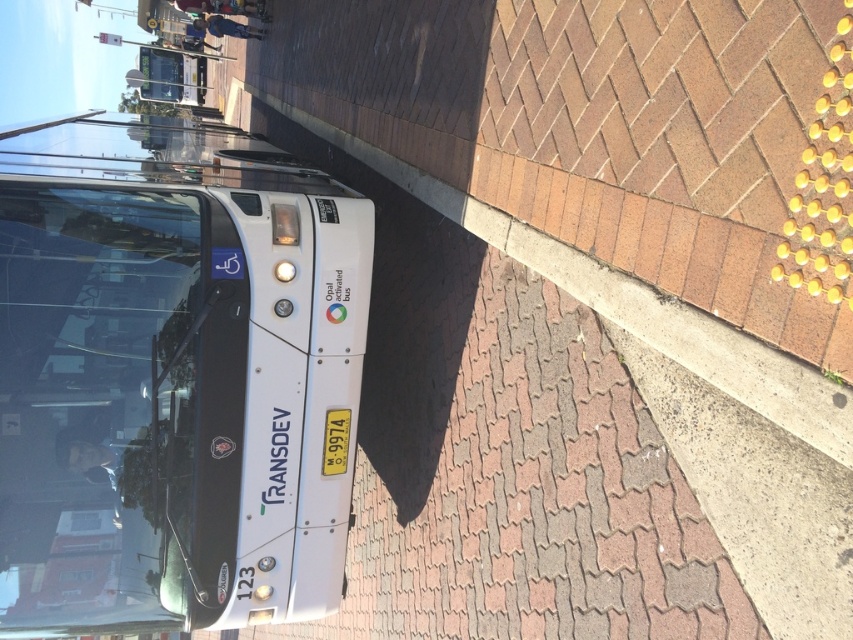
Between white matte bus at left and concrete at lower right, which one has more height?

white matte bus at left

Between white matte bus at left and concrete at lower right, which one is positioned lower?

concrete at lower right is below.

Who is more distant from viewer, [120,541] or [579,300]?

Point [120,541]

Locate an element on the screen. Image resolution: width=853 pixels, height=640 pixels. white matte bus at left is located at coordinates tap(173, 378).